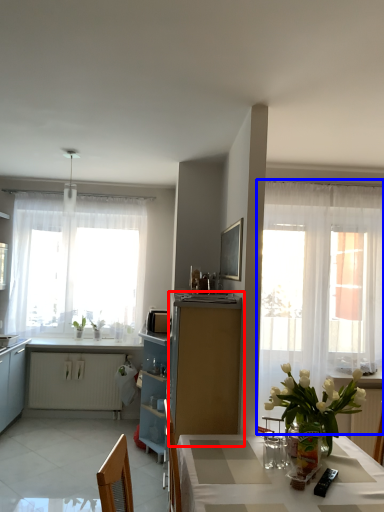
Question: Which of the following is the farthest to the observer, cabinetry (highlighted by a red box) or curtain (highlighted by a blue box)?

Choices:
 (A) cabinetry
 (B) curtain

Answer: (B)